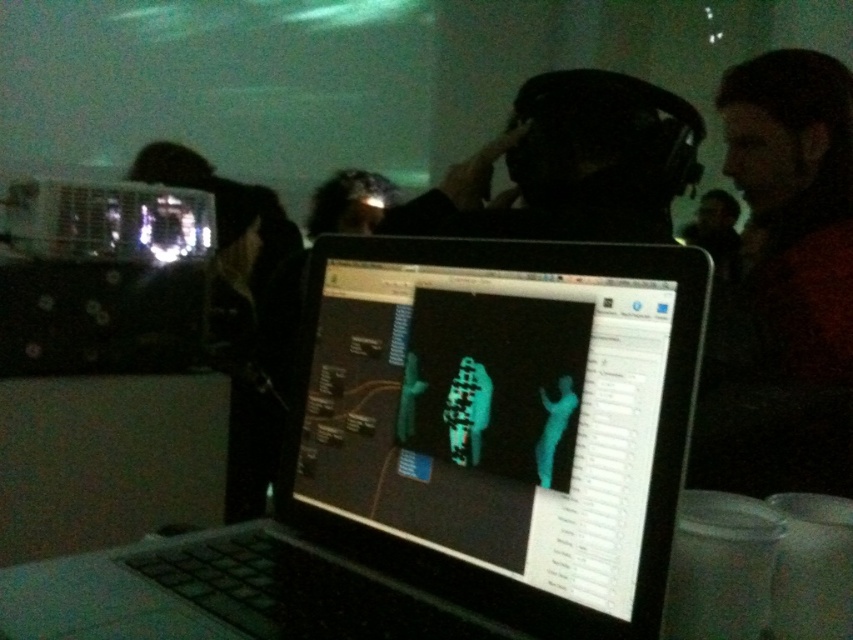
You are an observer in the workshop. You notice two points marked on the laptop screen at coordinates point (316, 566) and point (398, 232). Which point is nearer to your viewpoint?

Point (316, 566) is closer to the camera than point (398, 232), so the point at (316, 566) is nearer to your viewpoint.

You are setting up a presentation and need to place the black plastic laptop at center and the black matte headphones at center on a small table. Which object should you place first to ensure they both fit?

The black plastic laptop at center is smaller than the black matte headphones at center, so you should place the black plastic laptop at center first to ensure both fit on the table.